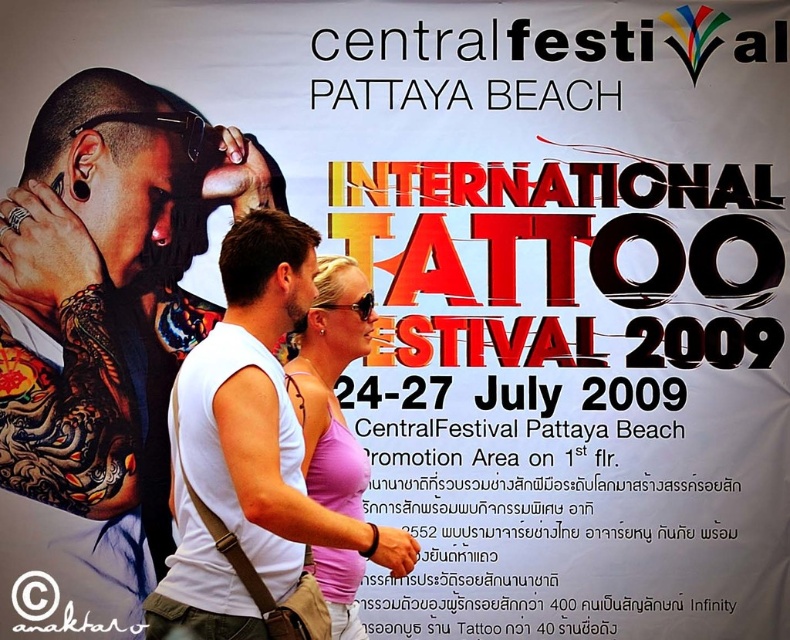
Is white matte tank top at center closer to the viewer compared to pink fabric tank top at center?

That is False.

Who is more forward, (x=19, y=404) or (x=363, y=344)?

Positioned in front is point (x=363, y=344).

Describe the element at coordinates (108, 305) in the screenshot. I see `white matte tank top at center` at that location.

Identify the location of white matte tank top at center. (108, 305).